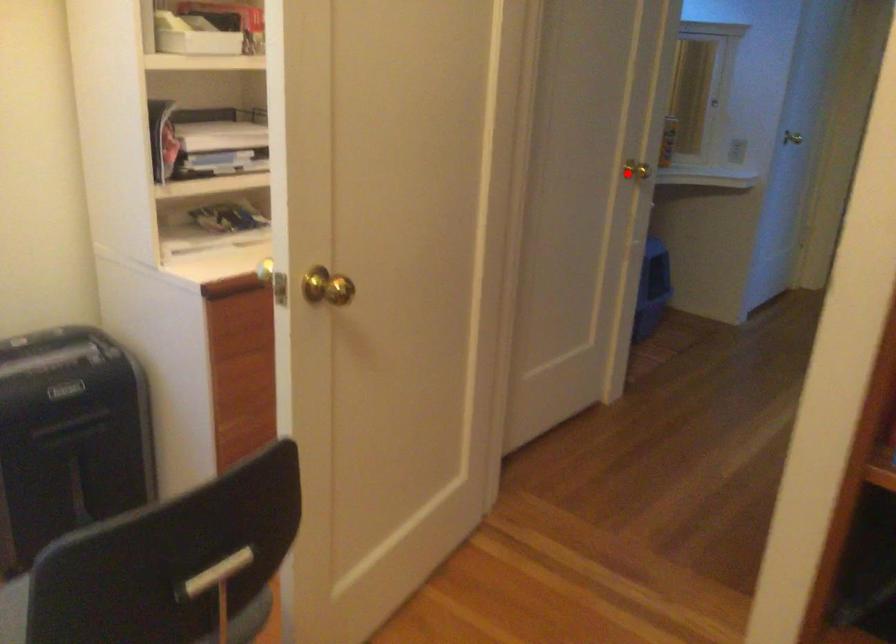
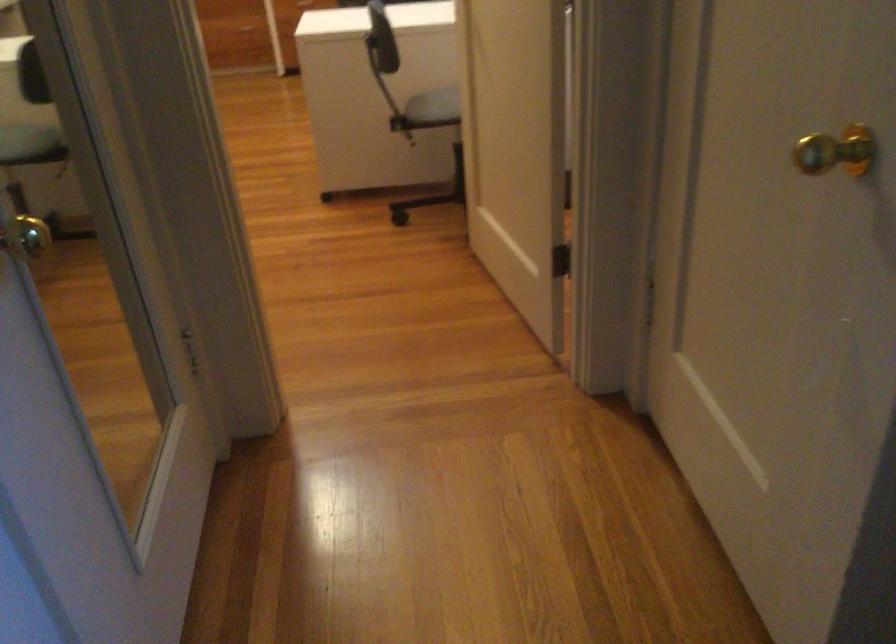
Question: I am providing you with two images of the same scene from different viewpoints. In image1, a red point is highlighted. Considering the same 3D point in image2, which of the following is correct?

Choices:
 (A) It is closer
 (B) It is farther

Answer: (A)